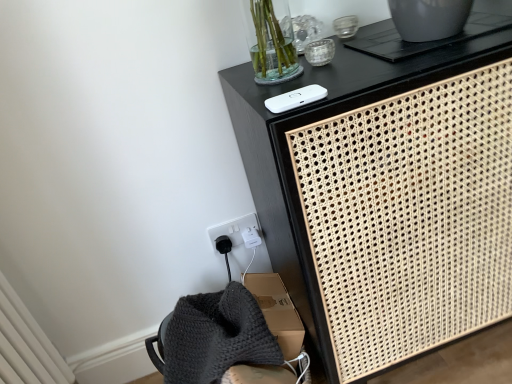
The width and height of the screenshot is (512, 384). I want to click on vacant area that is situated to the right of white matte ipod at upper center, so click(380, 72).